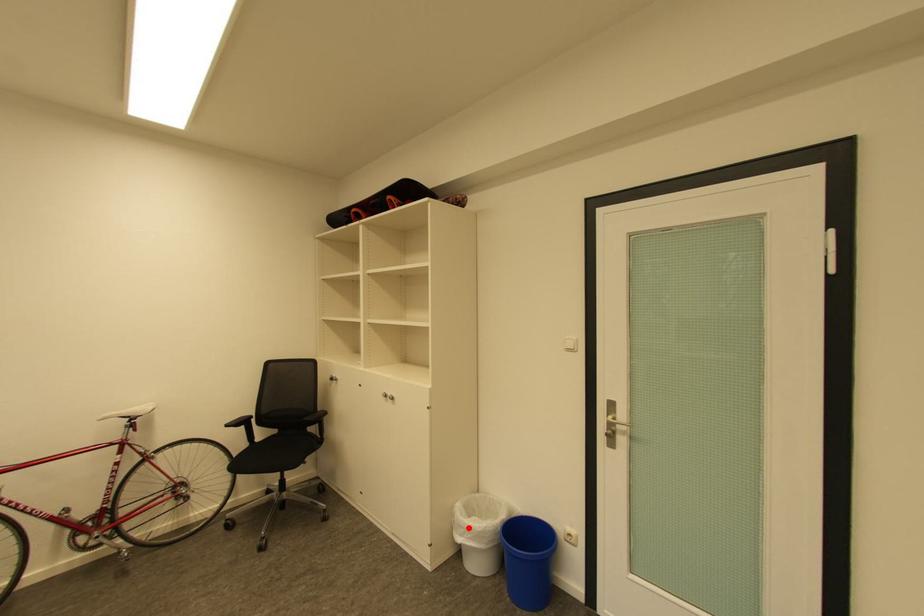
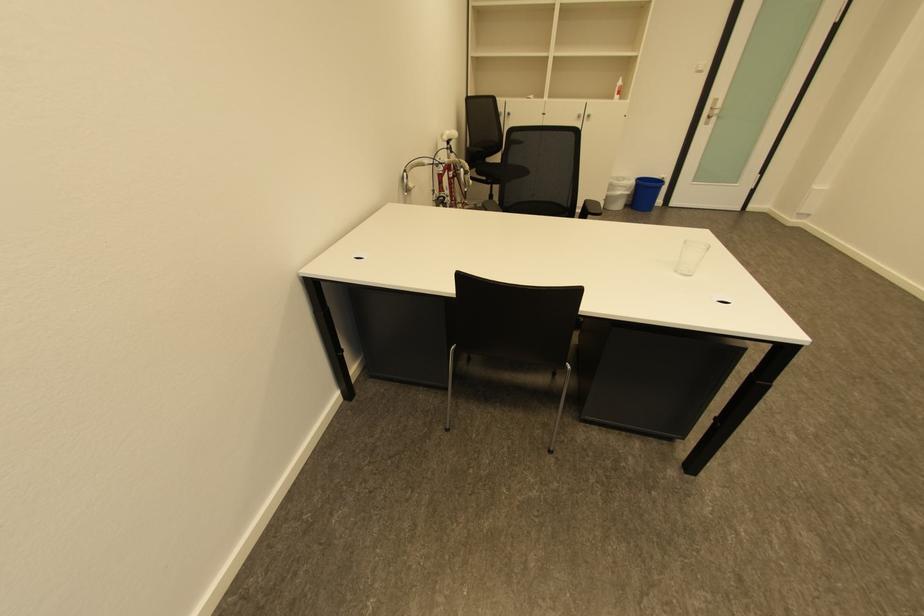
Question: I am providing you with two images of the same scene from different viewpoints. Given a red point in image1, look at the same physical point in image2. Is it:

Choices:
 (A) Closer to the viewpoint
 (B) Farther from the viewpoint

Answer: (A)